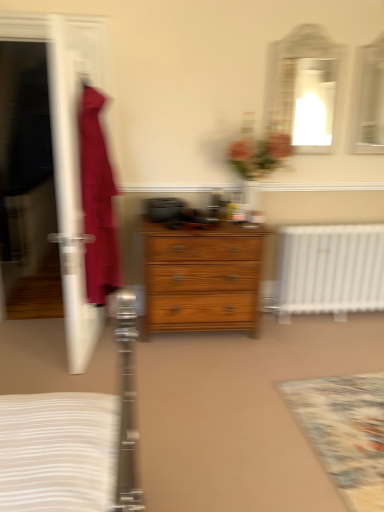
Question: From the image's perspective, is wooden chest of drawers at center located beneath floral carpet at lower right?

Choices:
 (A) no
 (B) yes

Answer: (A)

Question: Is wooden chest of drawers at center thinner than floral carpet at lower right?

Choices:
 (A) yes
 (B) no

Answer: (A)

Question: From a real-world perspective, is wooden chest of drawers at center physically below floral carpet at lower right?

Choices:
 (A) yes
 (B) no

Answer: (B)

Question: Is wooden chest of drawers at center bigger than floral carpet at lower right?

Choices:
 (A) no
 (B) yes

Answer: (B)

Question: Does wooden chest of drawers at center have a smaller size compared to floral carpet at lower right?

Choices:
 (A) no
 (B) yes

Answer: (A)

Question: Considering the relative positions of matte white mirror at upper right, which is the 1th mirror in left-to-right order, and wooden chest of drawers at center in the image provided, is matte white mirror at upper right, which is the 1th mirror in left-to-right order, to the left or to the right of wooden chest of drawers at center?

Choices:
 (A) right
 (B) left

Answer: (A)

Question: Is matte white mirror at upper right, which is the 1th mirror in left-to-right order, taller or shorter than wooden chest of drawers at center?

Choices:
 (A) short
 (B) tall

Answer: (B)

Question: Is matte white mirror at upper right, which appears as the 2th mirror when viewed from the right, situated inside wooden chest of drawers at center or outside?

Choices:
 (A) outside
 (B) inside

Answer: (A)

Question: Is point (304, 136) positioned closer to the camera than point (173, 290)?

Choices:
 (A) farther
 (B) closer

Answer: (A)

Question: From the image's perspective, is matte glass mirror at upper center, the 2th mirror when ordered from left to right, positioned above or below matte white mirror at upper right, which appears as the 2th mirror when viewed from the right?

Choices:
 (A) below
 (B) above

Answer: (B)

Question: In the image, is matte glass mirror at upper center, the 2th mirror when ordered from left to right, positioned in front of or behind matte white mirror at upper right, which appears as the 2th mirror when viewed from the right?

Choices:
 (A) behind
 (B) front

Answer: (A)

Question: Is matte glass mirror at upper center, the 2th mirror when ordered from left to right, wider or thinner than matte white mirror at upper right, which is the 1th mirror in left-to-right order?

Choices:
 (A) thin
 (B) wide

Answer: (B)

Question: Looking at the image, does matte glass mirror at upper center, the 2th mirror when ordered from left to right, seem bigger or smaller compared to matte white mirror at upper right, which appears as the 2th mirror when viewed from the right?

Choices:
 (A) small
 (B) big

Answer: (A)

Question: Do you think transparent plastic screen door at left is within floral carpet at lower right, or outside of it?

Choices:
 (A) outside
 (B) inside

Answer: (A)

Question: Considering the positions of transparent plastic screen door at left and floral carpet at lower right in the image, is transparent plastic screen door at left bigger or smaller than floral carpet at lower right?

Choices:
 (A) big
 (B) small

Answer: (A)